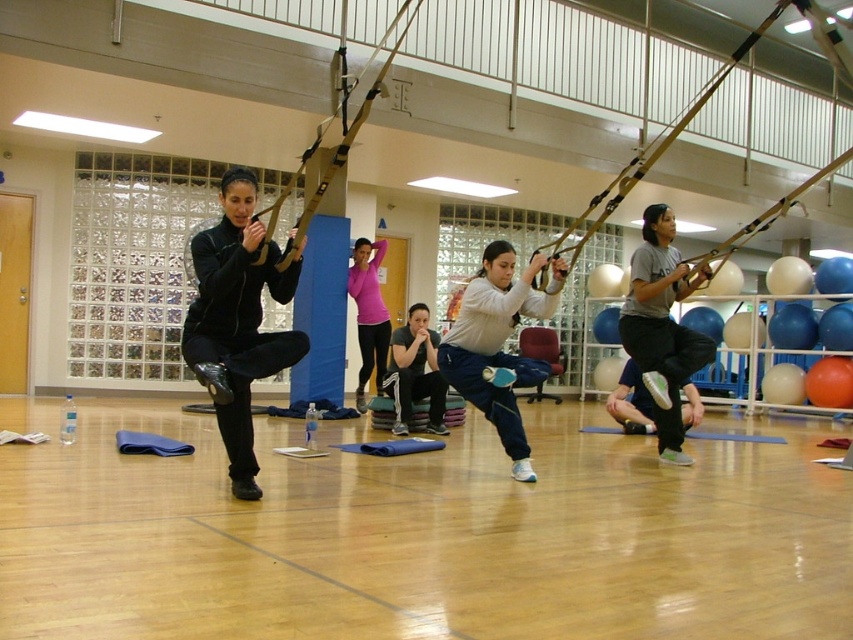
You are a photographer setting up a shoot in the gym. You want to capture both the light gray fabric pants at center and the pink fabric at center in the same frame. Which object should you focus on first to ensure both are in the shot?

You should focus on the light gray fabric pants at center first because it is in front of the pink fabric at center, so by focusing on the closer object, both will be in the frame.

You are a photographer positioned at the front of the gymnasium and want to capture both the point at coordinates point (496, 268) and point (363, 333) in your shot. Which point will appear larger in your photo?

Point (496, 268) is closer to the camera than point (363, 333), so it will appear larger in the photo.

You are a photographer setting up a shoot in the gym. You need to ensure that the light gray fabric pants at center and the gray fabric shirt at center are both visible in the frame. Given their sizes, which one might require more careful positioning to avoid being obscured by other elements?

The light gray fabric pants at center occupies less space than the gray fabric shirt at center, so the pants might require more careful positioning to avoid being obscured by other elements since they are smaller and easier to miss in the frame.